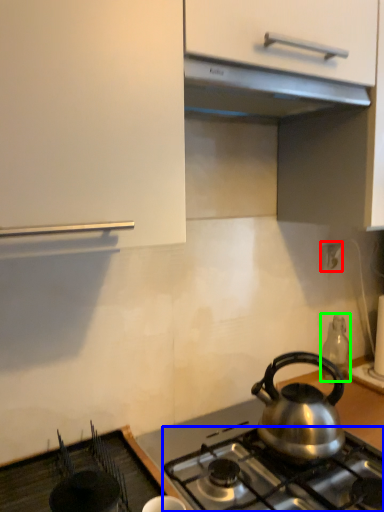
Question: Considering the real-world distances, which object is farthest from electric outlet (highlighted by a red box)? gas stove (highlighted by a blue box) or appliance (highlighted by a green box)?

Choices:
 (A) gas stove
 (B) appliance

Answer: (A)